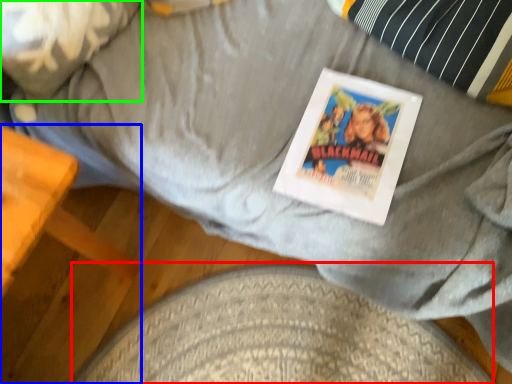
Question: Which is nearer to the dog bed (highlighted by a red box)? furniture (highlighted by a blue box) or pillow (highlighted by a green box).

Choices:
 (A) furniture
 (B) pillow

Answer: (A)